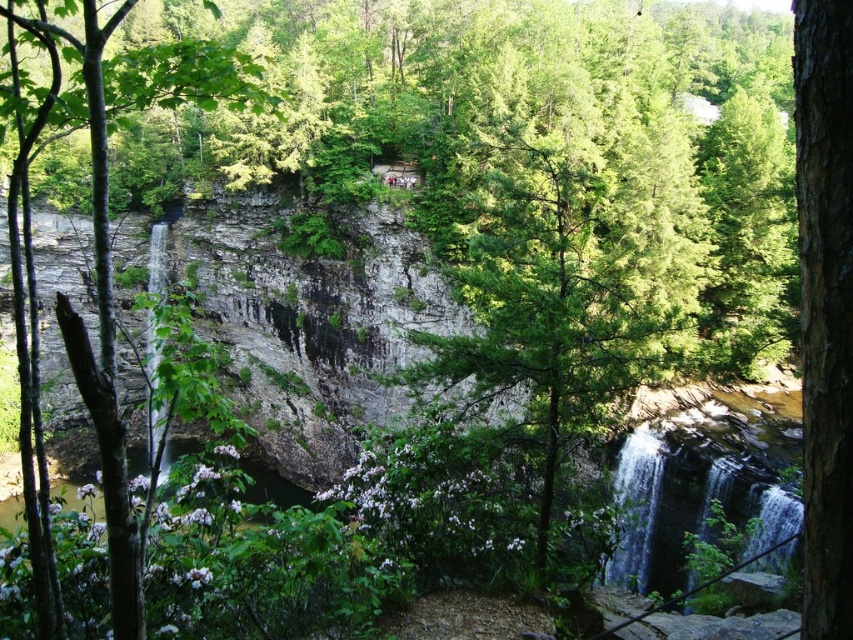
You are an environmental scientist assessing the vegetation in the area. You observe the green textured tree at center and the green leafy tree at center. Which tree has a smaller footprint in the landscape?

The green textured tree at center has a smaller footprint than the green leafy tree at center, as it occupies less space.

You are a hiker standing at the base of the waterfall. You notice two trees in the center of the scene. Which tree is closer to you, the green textured tree at center or the green leafy tree at center?

The green textured tree at center is 16.57 meters away from the green leafy tree at center. Since both are at the center, their distance from you depends on their positions relative to each other. However, the description only provides the distance between them, not their individual distances from your position. Therefore, it is impossible to determine which tree is closer to you based on the given information.